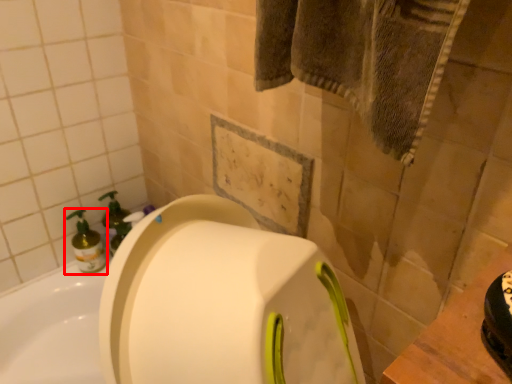
Question: From the image's perspective, where is cleaning product (annotated by the red box) located relative to soap dispenser?

Choices:
 (A) below
 (B) above

Answer: (A)